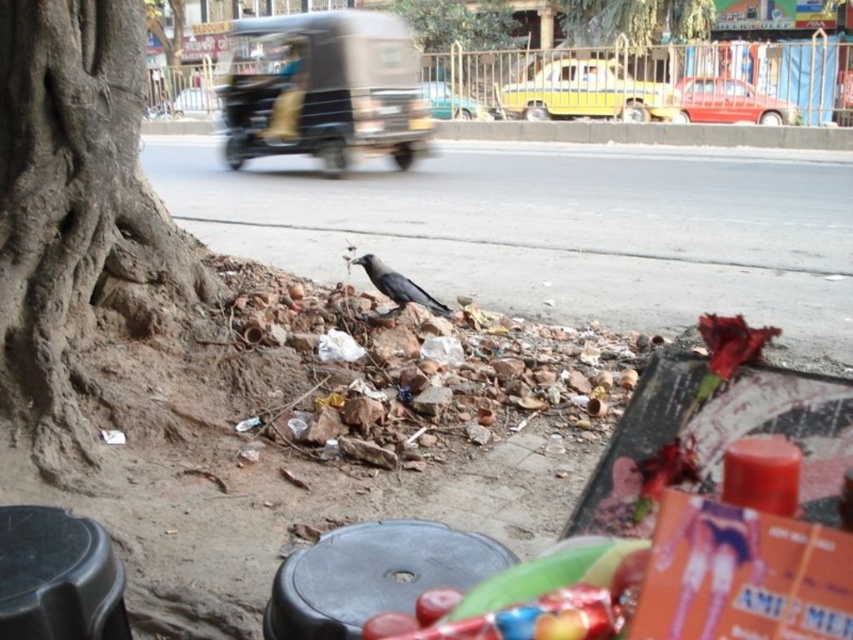
Question: Is yellow matte car at center above shiny black crow at center?

Choices:
 (A) yes
 (B) no

Answer: (A)

Question: Which of the following is the closest to the observer?

Choices:
 (A) shiny black crow at center
 (B) metallic silver car at center
 (C) yellow matte car at center

Answer: (A)

Question: Which of the following is the closest to the observer?

Choices:
 (A) (540, 93)
 (B) (306, 150)
 (C) (456, 113)
 (D) (384, 268)

Answer: (D)

Question: Is yellow matte car at center positioned at the back of red glossy car at upper right?

Choices:
 (A) no
 (B) yes

Answer: (B)

Question: Can you confirm if metallic black auto-rickshaw at upper center is wider than metallic silver car at center?

Choices:
 (A) yes
 (B) no

Answer: (B)

Question: Estimate the real-world distances between objects in this image. Which object is closer to the yellow matte car at center?

Choices:
 (A) metallic silver car at center
 (B) red glossy car at upper right

Answer: (B)